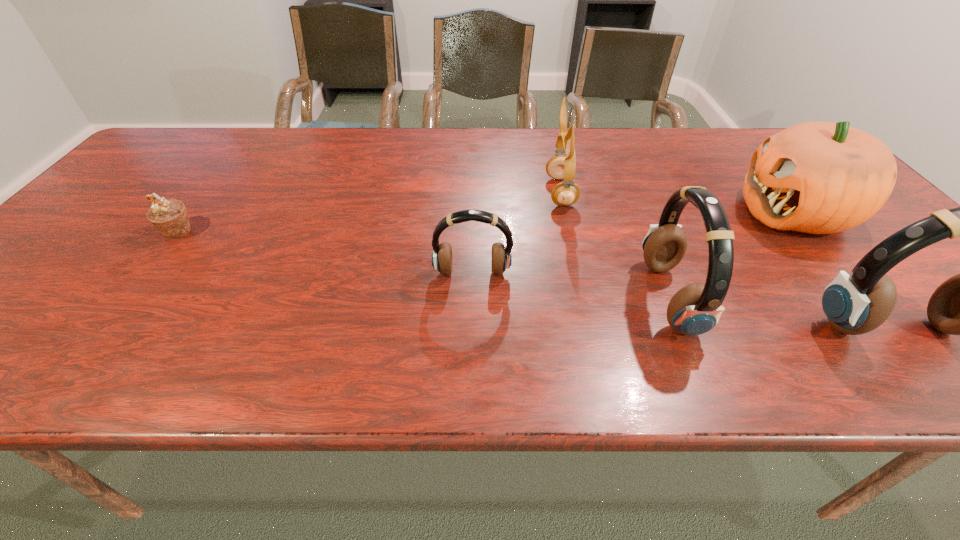
Where is `vacant space situated 0.250m on the ear cup of the second shortest headset`? vacant space situated 0.250m on the ear cup of the second shortest headset is located at coordinates (527, 299).

Where is `free region located on the ear cup of the second shortest headset`? This screenshot has height=540, width=960. free region located on the ear cup of the second shortest headset is located at coordinates (557, 299).

I want to click on free location located 0.380m on the front-facing side of the fourth object from right to left, so click(x=405, y=192).

Locate an element on the screen. The width and height of the screenshot is (960, 540). free point located 0.380m on the front-facing side of the fourth object from right to left is located at coordinates (405, 192).

At what (x,y) coordinates should I click in order to perform the action: click on free location located 0.120m on the front-facing side of the fourth object from right to left. Please return your answer as a coordinate pair (x, y). Image resolution: width=960 pixels, height=540 pixels. Looking at the image, I should click on (502, 192).

Find the location of a particular element. Image resolution: width=960 pixels, height=540 pixels. vacant position located 0.120m on the face of the pumpkin is located at coordinates (692, 212).

I want to click on free space located 0.330m on the face of the pumpkin, so click(609, 212).

What are the coordinates of `vacant position located 0.290m on the face of the pumpkin` in the screenshot? It's located at (625, 212).

Locate an element on the screen. The image size is (960, 540). free space located on the back of the leftmost object is located at coordinates (240, 150).

The width and height of the screenshot is (960, 540). I want to click on object present at the near edge, so click(x=695, y=309).